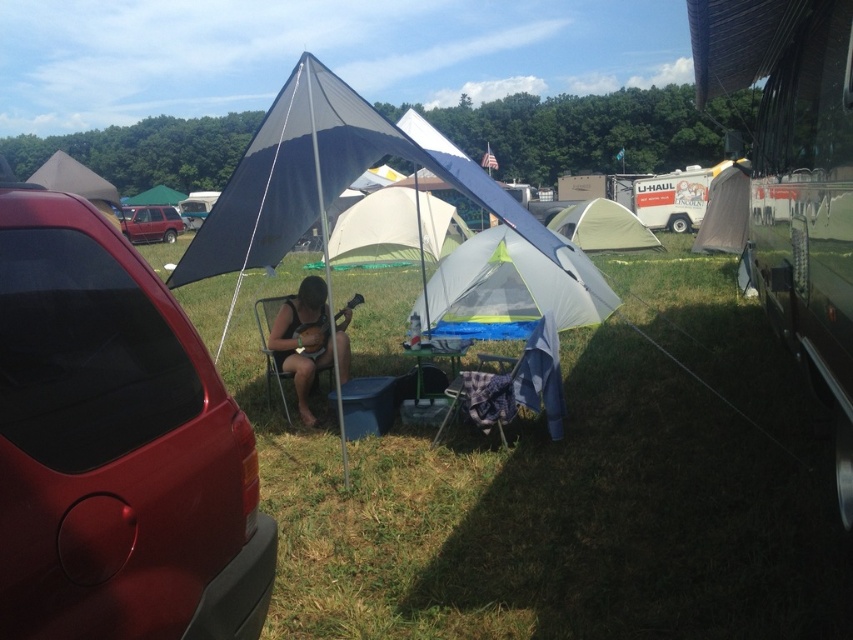
From the picture: You are planning to set up a tent for a family of four. You have two options in the scene, the white mesh tent at center and the gray fabric tent at center. Which tent should you choose based on size?

The white mesh tent at center is larger in size than the gray fabric tent at center, so you should choose the white mesh tent at center for a family of four.

Consider the image. You are planning to set up a new tent in the camping area. The white mesh tent at center is already placed. According to the coordinates provided, where should you place your new tent to ensure it is not overlapping with the existing one?

The white mesh tent at center is located at point (x=325, y=179). To avoid overlapping, place your new tent at a different coordinate such as (x=426, y=320) or (x=596, y=448).

You are planning to set up a small camping gear organizer. You have both the white mesh tent at center and the green plastic picnic table at center in view. Which object should you place your organizer on to ensure it has enough space?

The white mesh tent at center is larger in size than the green plastic picnic table at center, so placing the organizer on the white mesh tent at center would provide more space.